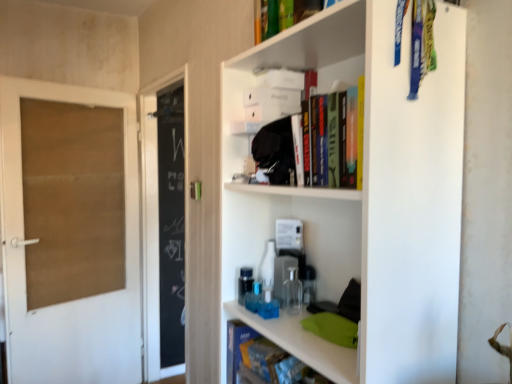
Question: Considering the relative positions of brown cardboard door at left and hardcover book at upper center, positioned as the 2th book in back-to-front order, in the image provided, is brown cardboard door at left to the left or to the right of hardcover book at upper center, positioned as the 2th book in back-to-front order,?

Choices:
 (A) right
 (B) left

Answer: (B)

Question: From their relative heights in the image, would you say brown cardboard door at left is taller or shorter than hardcover book at upper center, positioned as the 2th book in back-to-front order?

Choices:
 (A) short
 (B) tall

Answer: (B)

Question: Which of these objects is positioned closest to the white matte shelf at upper right?

Choices:
 (A) brown cardboard door at left
 (B) hardcover book at upper center, positioned as the 2th book in back-to-front order
 (C) blue matte book at lower center, positioned as the 2th book in front-to-back order

Answer: (C)

Question: Which object is positioned closest to the brown cardboard door at left?

Choices:
 (A) hardcover book at upper center, which is the 1th book from front to back
 (B) white matte shelf at upper right
 (C) blue matte book at lower center, which ranks as the first book in bottom-to-top order

Answer: (C)